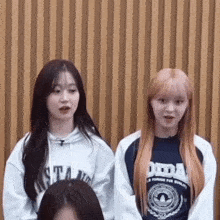
Identify the location of slat wood acoustic paneling. This screenshot has height=220, width=220. (107, 47).